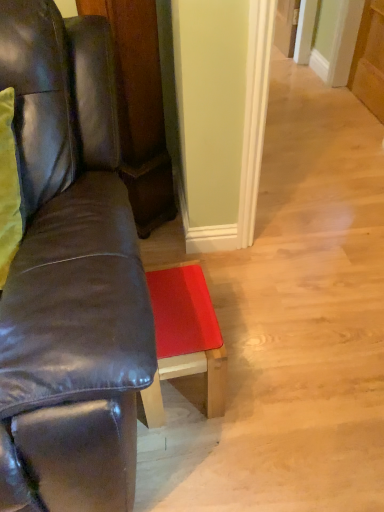
In order to click on vacant space situated above smooth red table at lower right (from a real-world perspective) in this screenshot , I will do `click(173, 312)`.